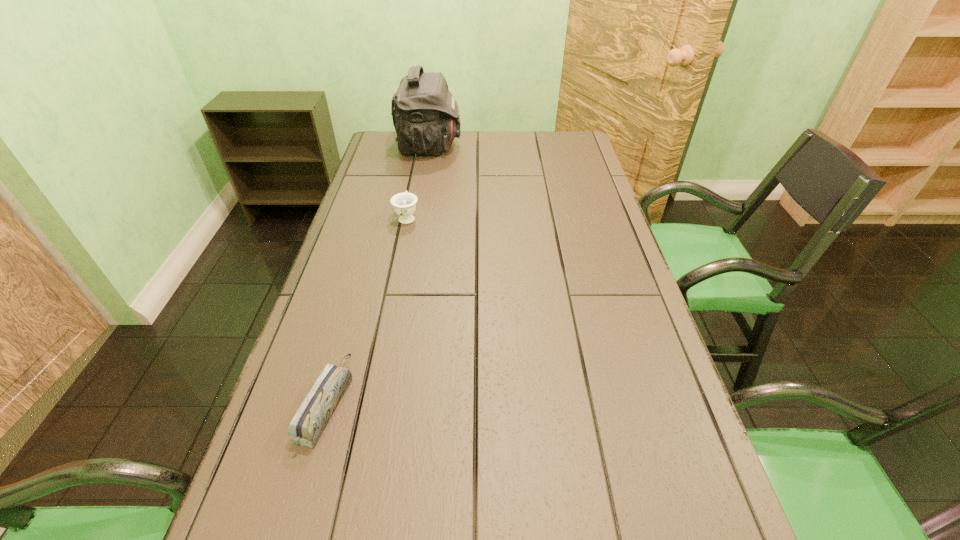
The width and height of the screenshot is (960, 540). What are the coordinates of `shoulder bag` in the screenshot? It's located at (425, 114).

At what (x,y) coordinates should I click in order to perform the action: click on the tallest object. Please return your answer as a coordinate pair (x, y). Looking at the image, I should click on (425, 114).

The width and height of the screenshot is (960, 540). I want to click on teacup, so click(x=404, y=204).

You are a GUI agent. You are given a task and a screenshot of the screen. Output one action in this format:
    pyautogui.click(x=<x>, y=<y>)
    Task: Click on the second farthest object
    The image size is (960, 540).
    Given the screenshot: What is the action you would take?
    pyautogui.click(x=404, y=204)

Find the location of a particular element. The height and width of the screenshot is (540, 960). the shortest object is located at coordinates (306, 427).

The height and width of the screenshot is (540, 960). In order to click on the nearest object in this screenshot , I will do `click(306, 427)`.

At what (x,y) coordinates should I click in order to perform the action: click on vacant position located 0.300m on the open flap of the shoulder bag. Please return your answer as a coordinate pair (x, y). The width and height of the screenshot is (960, 540). Looking at the image, I should click on click(x=541, y=147).

The width and height of the screenshot is (960, 540). What are the coordinates of `vacant area situated on the side of the second farthest object with the handle` in the screenshot? It's located at (414, 187).

Find the location of `free space located 0.190m on the side of the second farthest object with the handle`. free space located 0.190m on the side of the second farthest object with the handle is located at coordinates [416, 176].

You are a GUI agent. You are given a task and a screenshot of the screen. Output one action in this format:
    pyautogui.click(x=<x>, y=<y>)
    Task: Click on the free space located on the side of the second farthest object with the handle
    Image resolution: width=960 pixels, height=540 pixels.
    Given the screenshot: What is the action you would take?
    pyautogui.click(x=419, y=160)